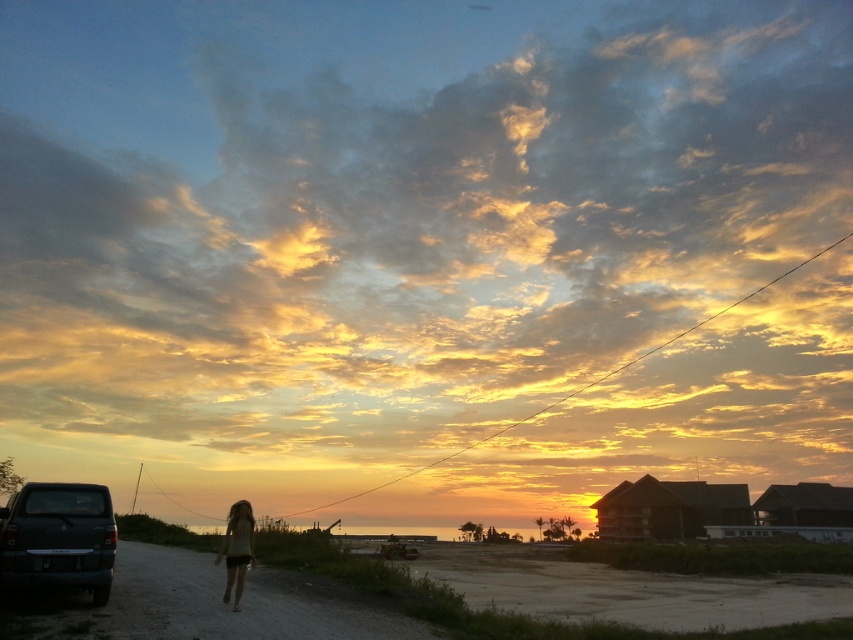
Based on the photo, you are standing at the center of the dirt road in the sunset scene. Which direction should you walk to reach the matte black truck at lower left?

You should walk towards the lower left direction to reach the matte black truck at lower left, as it is located at point coordinates lower left in the image.

You are standing at the edge of the dirt road in the sunset scene. You see a matte black truck at lower left and beige cotton shorts at lower left. Which object is closer to you?

The beige cotton shorts at lower left are closer to you since they are only 12.58 meters away from the matte black truck at lower left, but the exact distance from your position isn